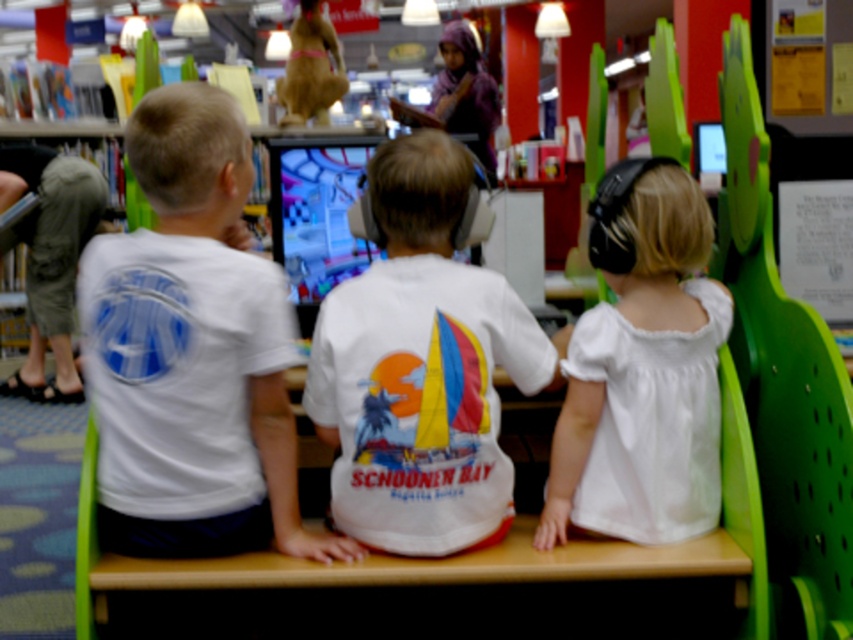
Question: In this image, where is white matte t-shirt at left located relative to white satin dress at center?

Choices:
 (A) right
 (B) left

Answer: (B)

Question: Which of these objects is positioned closest to the white satin dress at center?

Choices:
 (A) white matte t-shirt at center
 (B) white matte t-shirt at left
 (C) green plastic chair at right

Answer: (A)

Question: Which of the following is the closest to the observer?

Choices:
 (A) (633, 515)
 (B) (358, 352)
 (C) (785, 554)
 (D) (186, 456)

Answer: (D)

Question: Does white matte t-shirt at left appear under white satin dress at center?

Choices:
 (A) no
 (B) yes

Answer: (A)

Question: Can you confirm if white matte t-shirt at left is bigger than green plastic chair at right?

Choices:
 (A) no
 (B) yes

Answer: (A)

Question: Among these points, which one is farthest from the camera?

Choices:
 (A) [x=711, y=451]
 (B) [x=329, y=378]
 (C) [x=782, y=509]
 (D) [x=165, y=500]

Answer: (C)